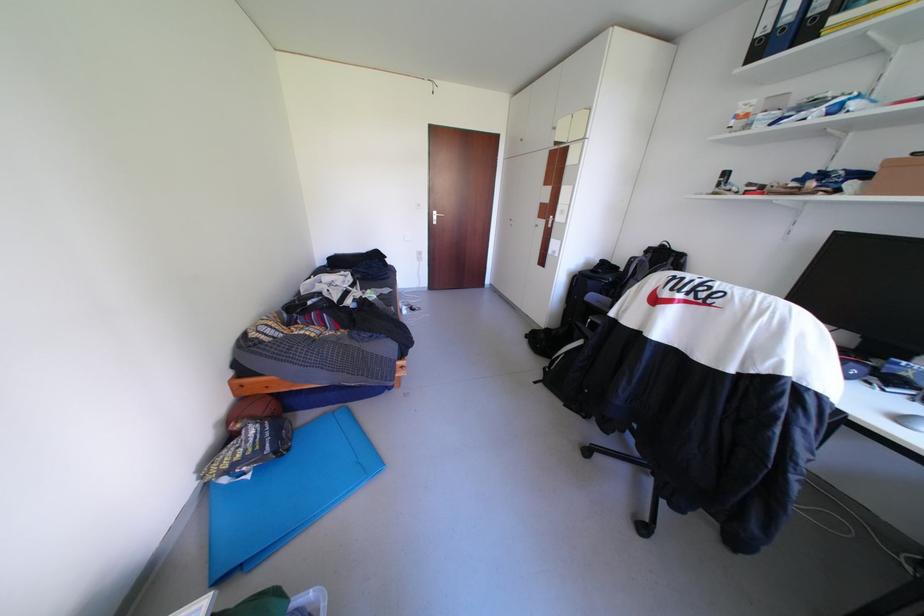
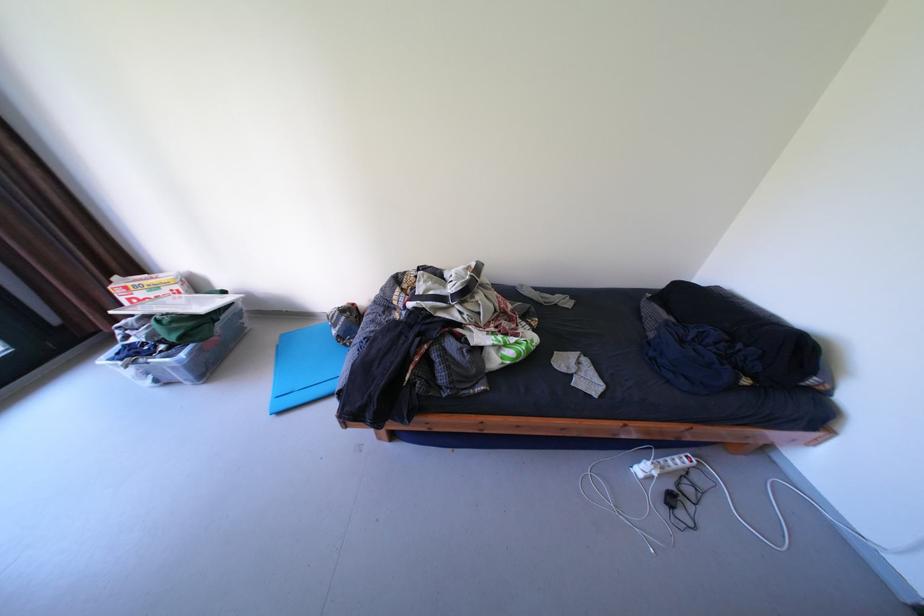
Locate, in the second image, the point that corresponds to point (416, 312) in the first image.

(649, 471)